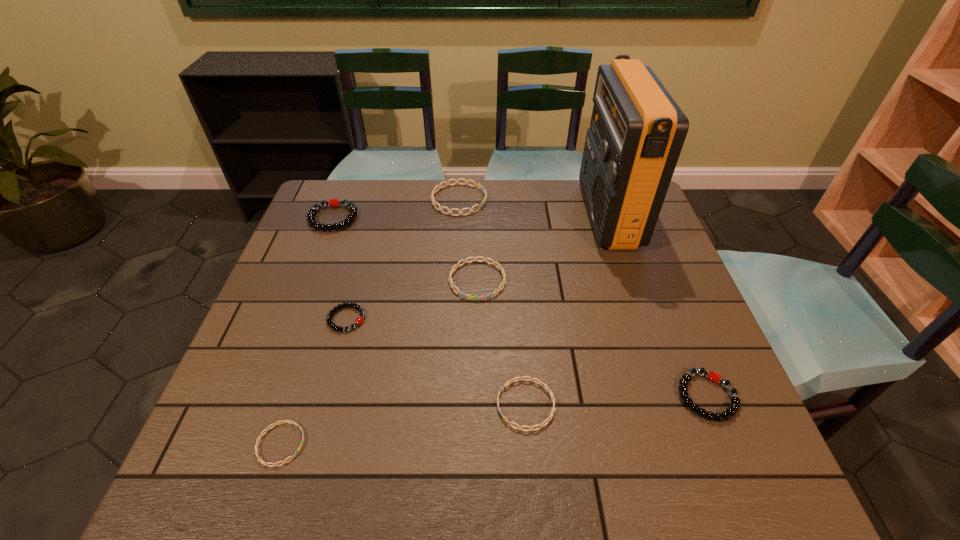
The image size is (960, 540). I want to click on object situated at the near left corner, so click(257, 442).

Identify the location of object situated at the far right corner. The image size is (960, 540). (637, 131).

Locate an element on the screen. free space at the far edge is located at coordinates (562, 180).

This screenshot has height=540, width=960. In the image, there is a desktop. In order to click on blank space at the near edge in this screenshot , I will do `click(499, 456)`.

Locate an element on the screen. This screenshot has height=540, width=960. vacant space at the left edge is located at coordinates [x=324, y=266].

Where is `vacant area at the right edge of the desktop`? vacant area at the right edge of the desktop is located at coordinates (717, 396).

The image size is (960, 540). In order to click on blank region between the farthest blue bracelet and the farthest black bracelet in this screenshot , I will do click(396, 209).

Where is `free space between the radio receiver and the fourth farthest object`? Image resolution: width=960 pixels, height=540 pixels. free space between the radio receiver and the fourth farthest object is located at coordinates (542, 247).

Locate an element on the screen. The height and width of the screenshot is (540, 960). free spot between the biggest blue bracelet and the shortest bracelet is located at coordinates (370, 322).

Where is `vacant space in between the rightmost black bracelet and the shortest bracelet`? The width and height of the screenshot is (960, 540). vacant space in between the rightmost black bracelet and the shortest bracelet is located at coordinates (493, 420).